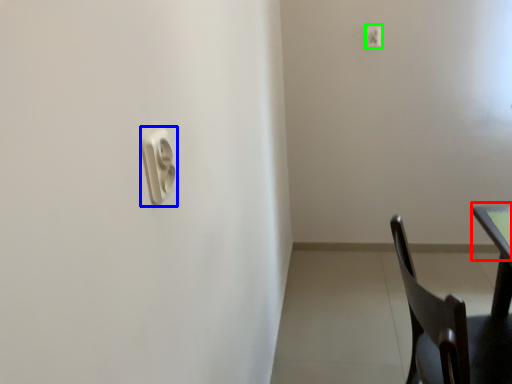
Question: Based on their relative distances, which object is nearer to table top (highlighted by a red box)? Choose from light switch (highlighted by a blue box) and light switch (highlighted by a green box).

Choices:
 (A) light switch
 (B) light switch

Answer: (A)